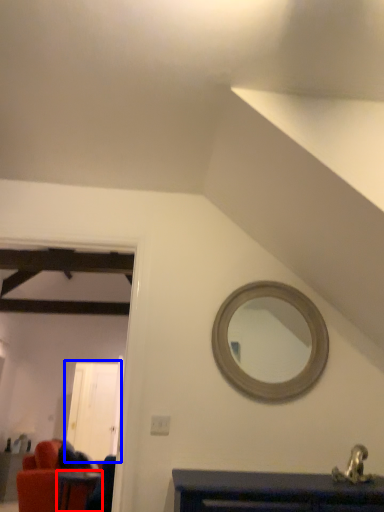
Question: Which object appears closest to the camera in this image, table (highlighted by a red box) or glass door (highlighted by a blue box)?

Choices:
 (A) table
 (B) glass door

Answer: (A)